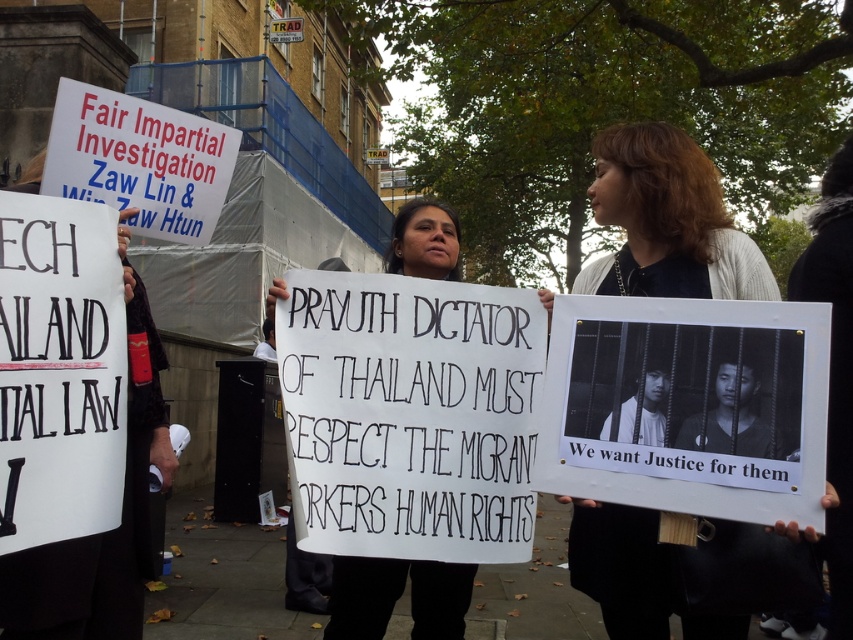
Does matte white cardigan at center appear on the left side of white paper sign at center?

No, matte white cardigan at center is not to the left of white paper sign at center.

Which is below, matte white cardigan at center or white paper sign at center?

Positioned lower is white paper sign at center.

Describe the element at coordinates (668, 220) in the screenshot. The width and height of the screenshot is (853, 640). I see `matte white cardigan at center` at that location.

Find the location of a particular element. This screenshot has height=640, width=853. matte white cardigan at center is located at coordinates (668, 220).